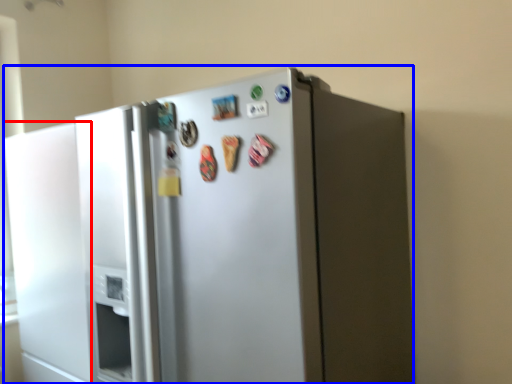
Question: Which of the following is the closest to the observer, door (highlighted by a red box) or refrigerator (highlighted by a blue box)?

Choices:
 (A) door
 (B) refrigerator

Answer: (B)